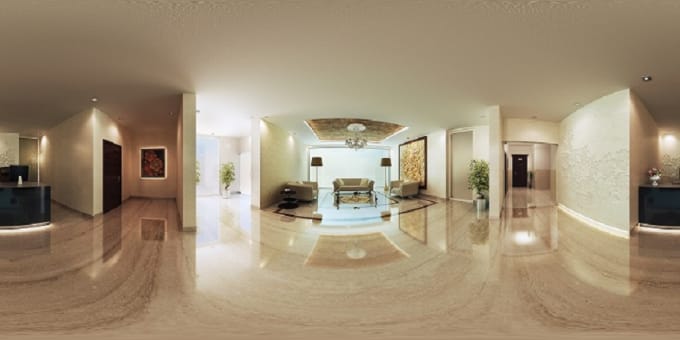
Locate an element on the screen. Image resolution: width=680 pixels, height=340 pixels. black table on the far right side is located at coordinates (663, 203).